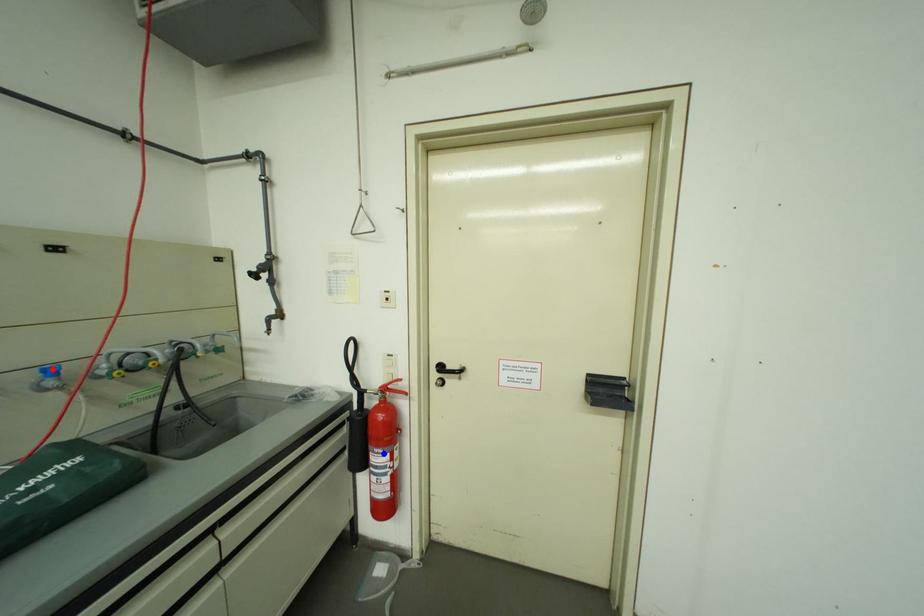
Question: Which of the two points in the image is closer to the camera?

Choices:
 (A) Blue point is closer.
 (B) Red point is closer.

Answer: (B)